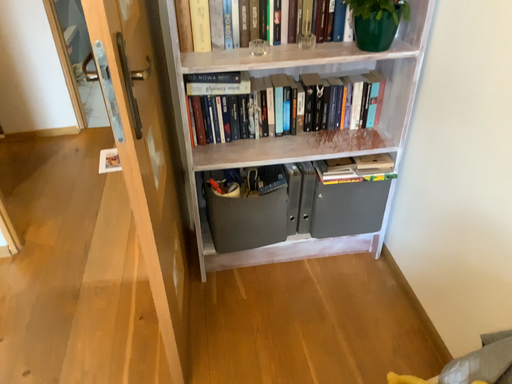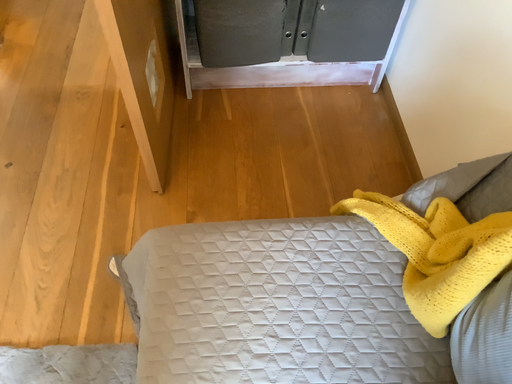
Question: Which way did the camera rotate in the video?

Choices:
 (A) rotated upward
 (B) rotated downward

Answer: (B)